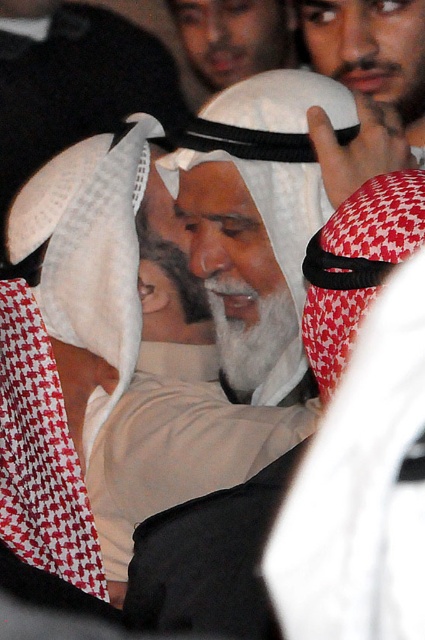
Question: Which of the following is the closest to the observer?

Choices:
 (A) white matte headscarf at upper center
 (B) white matte keffiyeh at center

Answer: (A)

Question: Which point is farther to the camera?

Choices:
 (A) (204, 83)
 (B) (388, 61)

Answer: (A)

Question: Is white matte headscarf at upper center below white matte keffiyeh at center?

Choices:
 (A) no
 (B) yes

Answer: (B)

Question: Can you confirm if white matte headscarf at upper center is thinner than white matte keffiyeh at center?

Choices:
 (A) yes
 (B) no

Answer: (A)

Question: Is white matte headscarf at upper center in front of white matte keffiyeh at center?

Choices:
 (A) no
 (B) yes

Answer: (B)